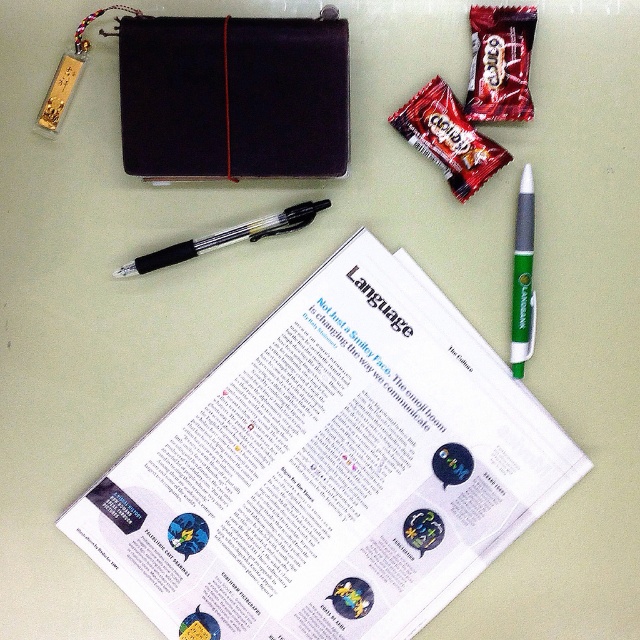
You are organizing a desk and need to place a green plastic pen at upper right and a transparent plastic pen at center. According to the image, which pen is positioned to the right side?

The green plastic pen at upper right is positioned to the right of the transparent plastic pen at center.

You have two pens on your desk. The green plastic pen at upper right and the transparent plastic pen at center. Which pen is smaller?

The green plastic pen at upper right is smaller than the transparent plastic pen at center.